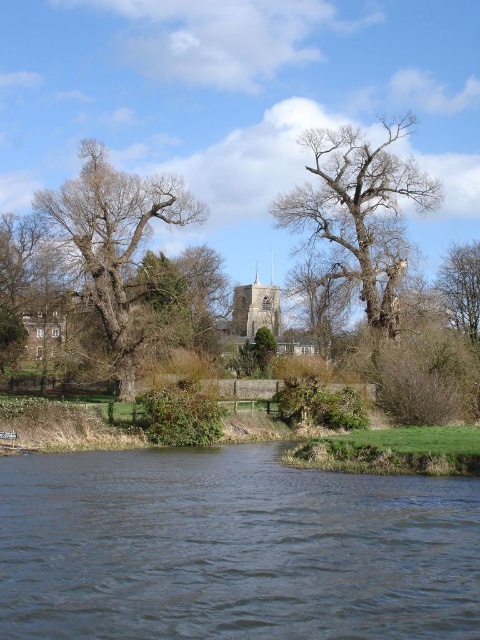
You are standing on the riverbank and want to take a photo of the dark blue water at center and the bare wood tree at upper center. Which object should you frame first in your camera viewfinder to ensure both are in the shot?

You should frame the dark blue water at center first since it is to the left of the bare wood tree at upper center, ensuring both are included in the photo.

You are an artist planning to paint the scene. You have a canvas that can only accommodate one of the two main elements from the image. The elements are the dark blue water at center and the bare wood tree at upper center. Based on their widths, which one should you choose to fit better on your canvas?

The dark blue water at center might be wider than the bare wood tree at upper center, so it would fit better on the canvas if width is the main concern.